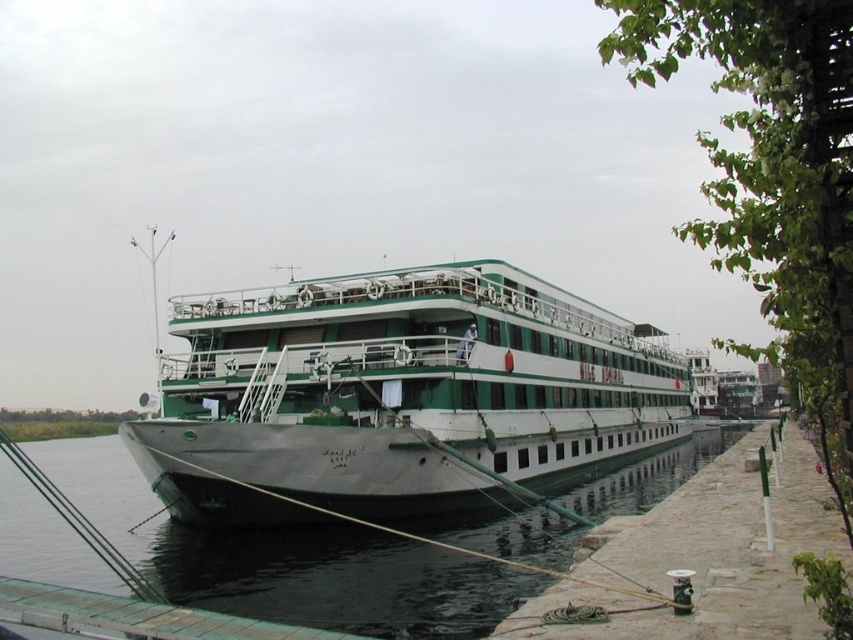
You are a photographer planning to take a picture of the green matte ship at center and the black rubber water at lower left. Based on their sizes in the scene, which object should you focus on first to ensure both are in frame?

The green matte ship at center is larger than the black rubber water at lower left, so you should focus on the green matte ship at center first to ensure both fit within the frame.

You are a sailor on the green matte ship at center. You need to secure the ship using ropes attached to the dock. Which direction should you look to find the black rubber water at lower left where the dock is located?

The green matte ship at center is positioned over the black rubber water at lower left, so the dock is located in the lower left direction from the ship. You should look towards the lower left to find the dock.